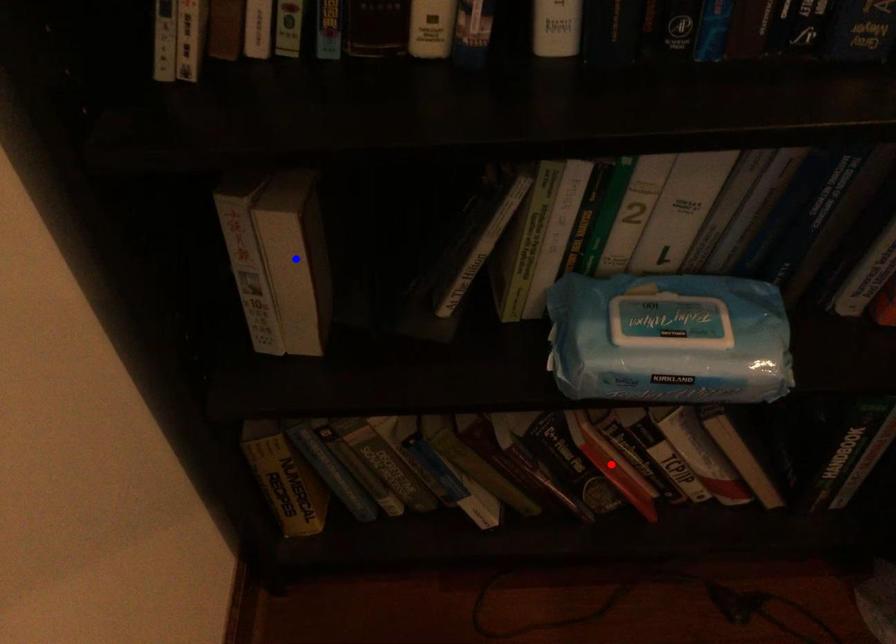
Question: Two points are marked on the image. Which point is closer to the camera?

Choices:
 (A) Blue point is closer.
 (B) Red point is closer.

Answer: (A)